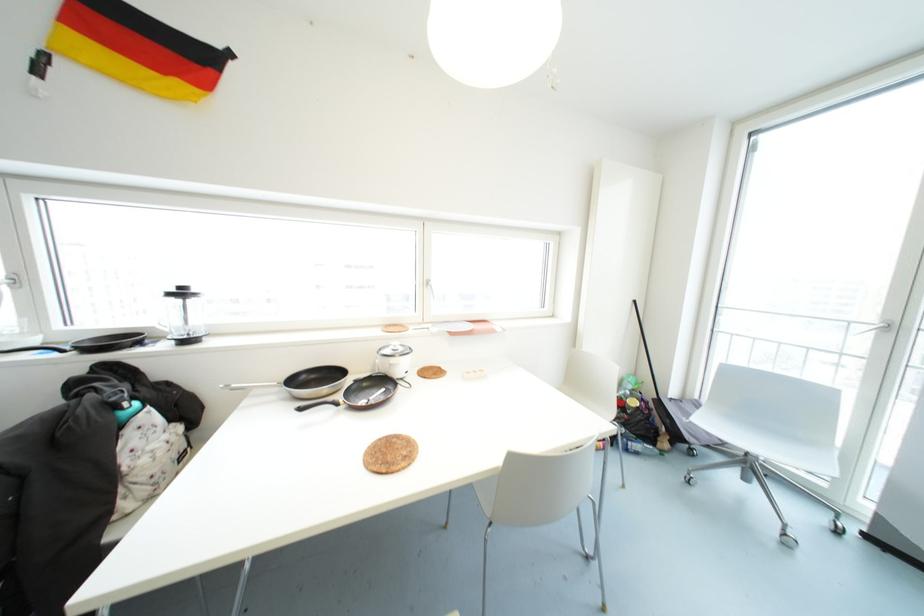
This screenshot has width=924, height=616. What do you see at coordinates (9, 281) in the screenshot?
I see `the white window handle` at bounding box center [9, 281].